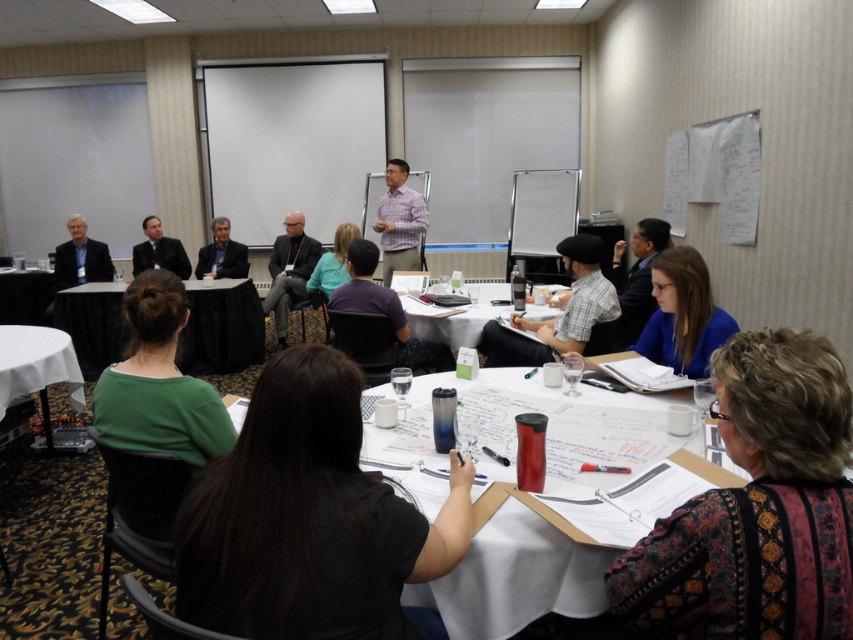
Question: Is blue fabric shirt at lower right closer to the viewer compared to black fabric table at lower left?

Choices:
 (A) no
 (B) yes

Answer: (B)

Question: Does purple shirt at center appear over black fabric table at lower left?

Choices:
 (A) yes
 (B) no

Answer: (B)

Question: Which of the following is the farthest from the observer?

Choices:
 (A) (410, 308)
 (B) (167, 355)

Answer: (A)

Question: Among these points, which one is farthest from the camera?

Choices:
 (A) (61, 268)
 (B) (39, 365)

Answer: (A)

Question: Which of the following is the farthest from the observer?

Choices:
 (A) green fabric shirt at lower left
 (B) plaid shirt at center
 (C) black matte water bottle at lower center

Answer: (B)

Question: Does plaid cotton shirt at center appear over matte black suit at upper right?

Choices:
 (A) no
 (B) yes

Answer: (A)